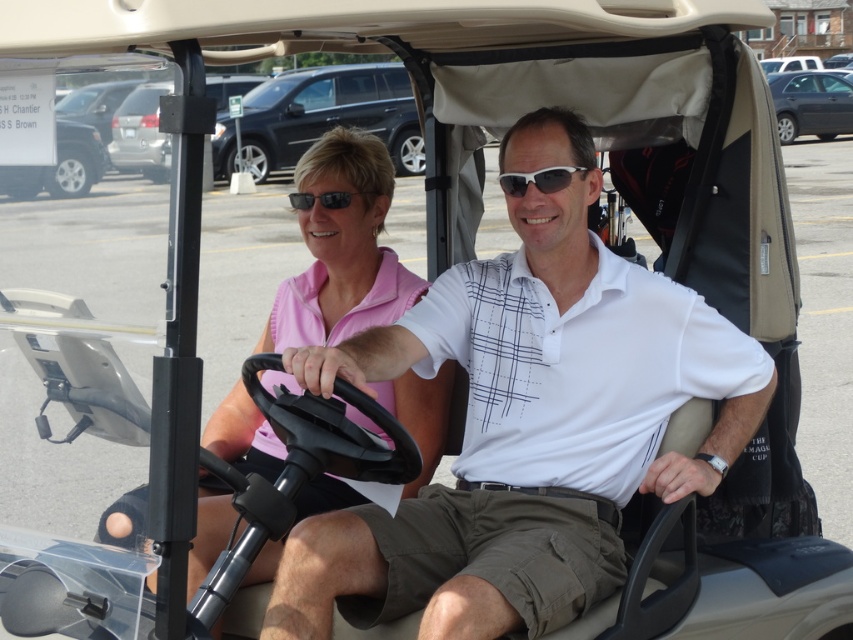
Does sunglasses at center have a greater width compared to black matte sunglasses at center?

No.

Who is lower down, sunglasses at center or black matte sunglasses at center?

black matte sunglasses at center

Is point (553, 179) less distant than point (293, 193)?

Yes, it is in front of point (293, 193).

The height and width of the screenshot is (640, 853). What are the coordinates of `sunglasses at center` in the screenshot? It's located at (538, 179).

Is pink fabric shirt at center above black matte sunglasses at center?

Actually, pink fabric shirt at center is below black matte sunglasses at center.

Who is higher up, pink fabric shirt at center or black matte sunglasses at center?

black matte sunglasses at center

Is point (236, 452) less distant than point (326, 205)?

No.

Locate an element on the screen. This screenshot has height=640, width=853. pink fabric shirt at center is located at coordinates (341, 250).

Can you confirm if pink fabric shirt at center is shorter than sunglasses at center?

In fact, pink fabric shirt at center may be taller than sunglasses at center.

Which is behind, point (329, 228) or point (566, 168)?

Positioned behind is point (329, 228).

Which is in front, point (300, 184) or point (514, 179)?

Point (514, 179) is in front.

Identify the location of pink fabric shirt at center. (341, 250).